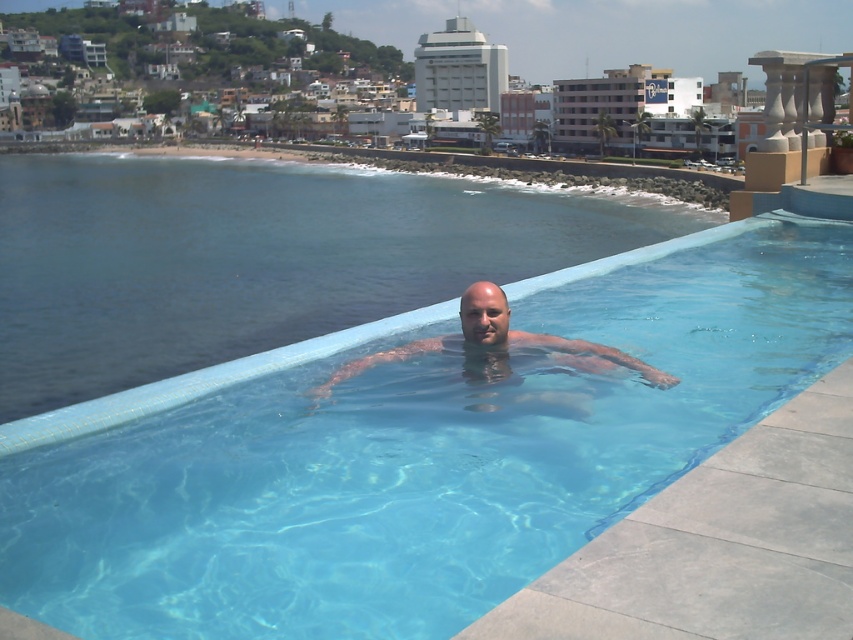
Question: Which object appears farthest from the camera in this image?

Choices:
 (A) clear blue water at center
 (B) clear glass pool at center

Answer: (A)

Question: Which point is farther to the camera?

Choices:
 (A) clear skin at center
 (B) clear glass pool at center
 (C) clear blue water at center

Answer: (C)

Question: Does clear glass pool at center have a greater width compared to clear skin at center?

Choices:
 (A) no
 (B) yes

Answer: (B)

Question: Which point is farther from the camera taking this photo?

Choices:
 (A) (672, 385)
 (B) (177, 340)

Answer: (B)

Question: Does clear glass pool at center appear on the right side of clear blue water at center?

Choices:
 (A) no
 (B) yes

Answer: (B)

Question: Does clear glass pool at center have a larger size compared to clear blue water at center?

Choices:
 (A) yes
 (B) no

Answer: (B)